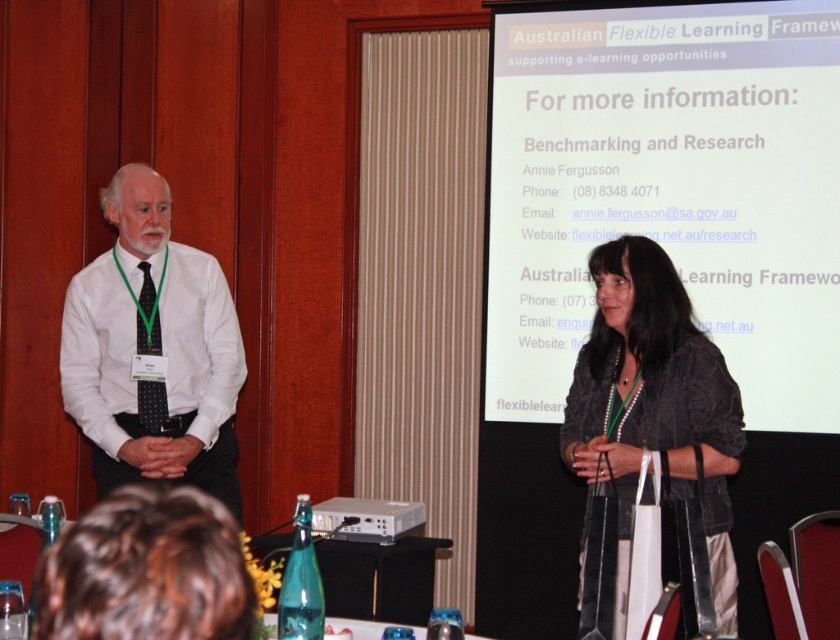
You are an attendee at this presentation and need to locate the dark gray textured jacket at center. Based on the coordinates provided in the scene description, can you determine its position relative to the projection screen?

The dark gray textured jacket at center is located at coordinates point (654, 419), which places it near the lower right portion of the image, closer to the projection screen.

From the picture: You are an attendee at this presentation and need to locate the speaker who is wearing a dark gray textured jacket at center. Can you see the entire white matte projection screen at upper center while focusing on the speaker?

The white matte projection screen at upper center is much taller than the dark gray textured jacket at center, so yes, you can see the entire white matte projection screen at upper center while focusing on the speaker wearing the dark gray textured jacket at center.

You are an event organizer who needs to set up a new projector. The projector can only project images onto surfaces larger than the dark gray textured jacket at center. Can the white matte projection screen at upper center accommodate the projector?

The white matte projection screen at upper center has a larger size compared to the dark gray textured jacket at center, so yes, the projector can be used with the white matte projection screen at upper center since it meets the size requirement.